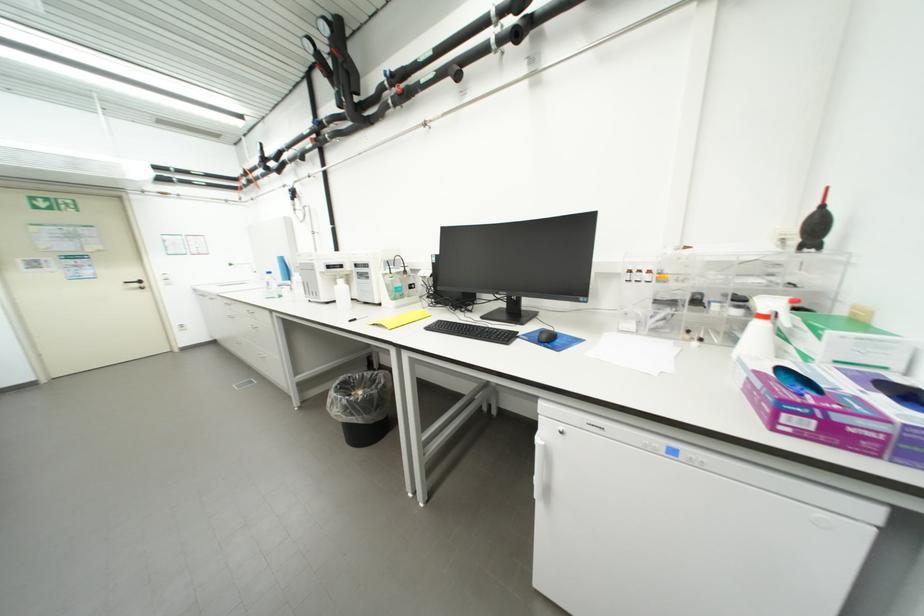
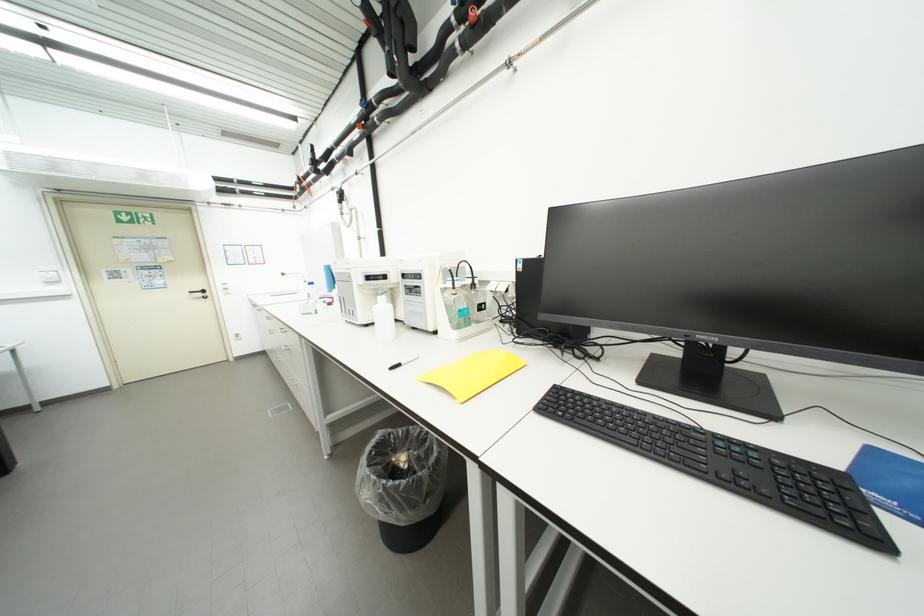
In a continuous first-person perspective shot, in which direction is the camera moving?

The cameraman walked toward left, forward.